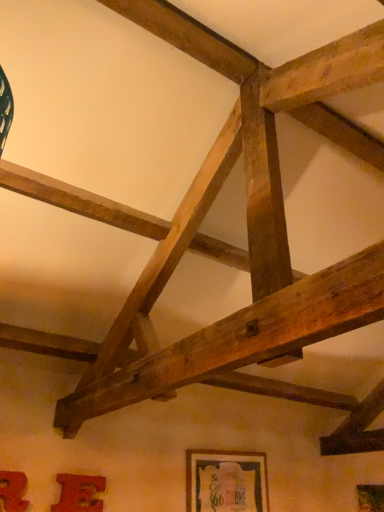
Question: Considering the positions of matte red picture frame at lower left, which appears as the third picture frame when viewed from the back, and matte red picture frame at lower left, the 2th picture frame from the left, in the image, is matte red picture frame at lower left, which appears as the third picture frame when viewed from the back, bigger or smaller than matte red picture frame at lower left, the 2th picture frame from the left,?

Choices:
 (A) small
 (B) big

Answer: (B)

Question: Is matte red picture frame at lower left, which is the 1th picture frame in left-to-right order, taller or shorter than matte red picture frame at lower left, the second picture frame viewed from the front?

Choices:
 (A) tall
 (B) short

Answer: (A)

Question: Which object is positioned farthest from the matte red picture frame at lower left, the second picture frame viewed from the front?

Choices:
 (A) matte red picture frame at lower left, which appears as the third picture frame when viewed from the back
 (B) wooden framed poster at lower center, which is the third picture frame in left-to-right order

Answer: (B)

Question: Which is farther from the matte red picture frame at lower left, which appears as the third picture frame when viewed from the back?

Choices:
 (A) matte red picture frame at lower left, acting as the 2th picture frame starting from the right
 (B) wooden framed poster at lower center, positioned as the 1th picture frame in back-to-front order

Answer: (B)